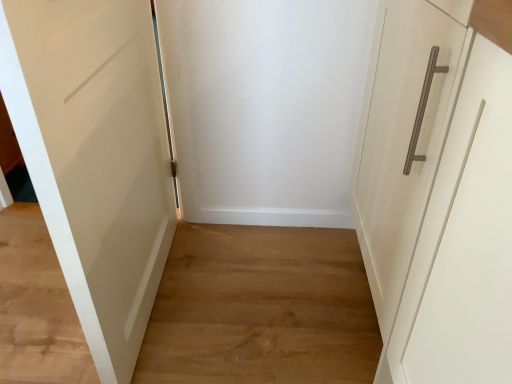
At what (x,y) coordinates should I click in order to perform the action: click on empty space that is ontop of wooden floor at center (from a real-world perspective). Please return your answer as a coordinate pair (x, y). Looking at the image, I should click on (207, 285).